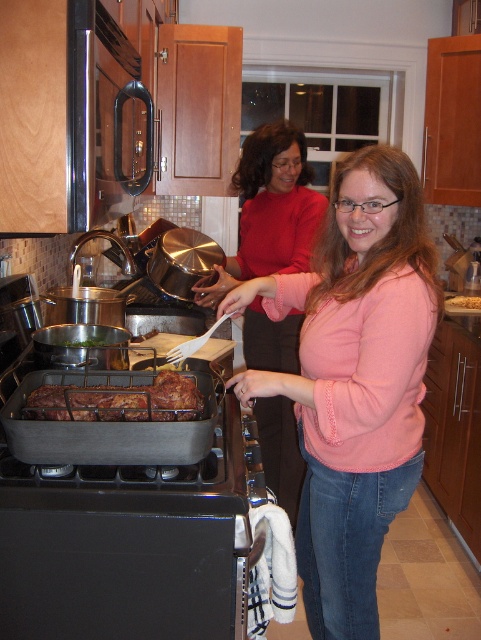
You are a chef standing in the kitchen and need to reach both the pink matte sweater at center and the brown crispy meat at center. The minimum distance you can reach is 14 inches. Can you reach both items without moving your position?

The pink matte sweater at center and brown crispy meat at center are 14.49 inches apart. Since the minimum distance you can reach is 14 inches, you can reach both items without moving your position because 14.49 inches is within your reach range.

Consider the image. You are a chef preparing to place a golden brown bread at center onto a plate. The plate you have is the same size as the pink sweater at center. Will the bread fit on the plate?

The pink sweater at center has a larger size compared to golden brown bread at center. Since the plate is the same size as the pink sweater at center, the golden brown bread at center will fit on the plate because it is smaller than the sweater.